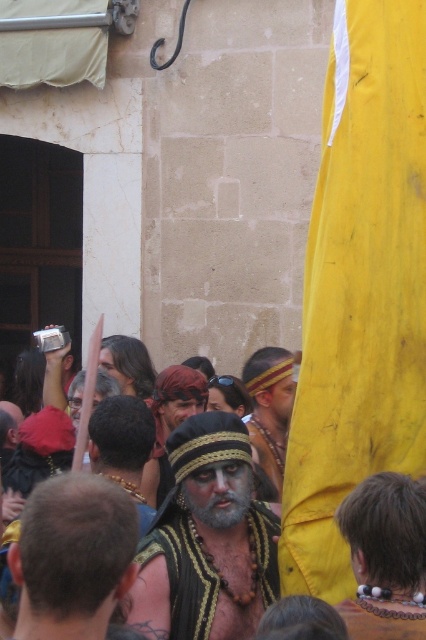
Can you confirm if bearded man with striped hat at center is positioned to the right of graywoollybeard at center?

No, bearded man with striped hat at center is not to the right of graywoollybeard at center.

Is point (92, 532) positioned behind point (198, 502)?

No, (92, 532) is closer to viewer.

Is point (46, 618) positioned behind point (198, 509)?

That is False.

This screenshot has width=426, height=640. Identify the location of bearded man with striped hat at center. (72, 556).

The height and width of the screenshot is (640, 426). Describe the element at coordinates (359, 289) in the screenshot. I see `yellow fabric flag at right` at that location.

Is yellow fabric flag at right shorter than beige textured fabric at center?

No.

Who is more distant from viewer, [339,236] or [144,444]?

The point [144,444] is more distant.

Where is `yellow fabric flag at right`? The image size is (426, 640). yellow fabric flag at right is located at coordinates (359, 289).

Does beige textured fabric at center appear on the left side of matte gold headband at center?

Indeed, beige textured fabric at center is positioned on the left side of matte gold headband at center.

Which is in front, point (89, 449) or point (290, 364)?

Point (89, 449) is in front.

Find the location of a particular element. This screenshot has height=640, width=426. beige textured fabric at center is located at coordinates (123, 445).